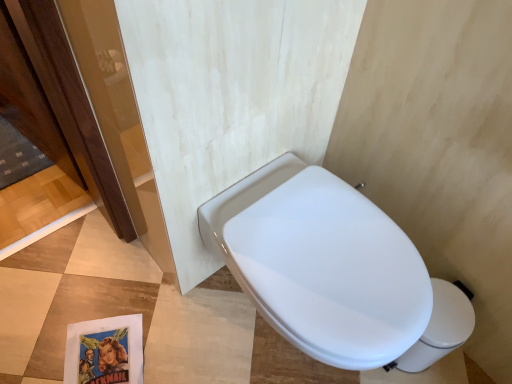
Question: Considering their positions, is white glossy bidet at center located in front of or behind white glossy toilet bowl at lower right?

Choices:
 (A) behind
 (B) front

Answer: (B)

Question: From the image's perspective, relative to white glossy toilet bowl at lower right, is white glossy bidet at center above or below?

Choices:
 (A) below
 (B) above

Answer: (B)

Question: From a real-world perspective, is white glossy bidet at center above or below white glossy toilet bowl at lower right?

Choices:
 (A) below
 (B) above

Answer: (B)

Question: Do you think white glossy toilet bowl at lower right is within white glossy bidet at center, or outside of it?

Choices:
 (A) inside
 (B) outside

Answer: (B)

Question: Is white glossy toilet bowl at lower right bigger or smaller than white glossy bidet at center?

Choices:
 (A) small
 (B) big

Answer: (A)

Question: Is white glossy toilet bowl at lower right wider or thinner than white glossy bidet at center?

Choices:
 (A) thin
 (B) wide

Answer: (A)

Question: From a real-world perspective, is white glossy toilet bowl at lower right above or below white glossy bidet at center?

Choices:
 (A) below
 (B) above

Answer: (A)